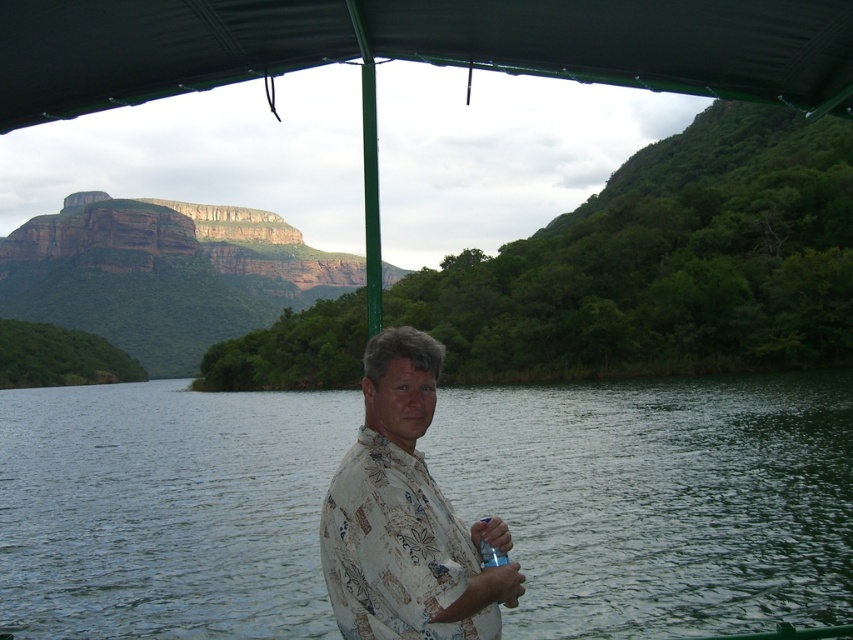
You are a photographer positioned at the camera. You see two points in the scene labeled as point (662,566) and point (424,362). Which point is closer to your camera?

Point (662,566) is further to the camera than point (424,362), so the closer point to the camera is point (424,362).

You are a photographer positioned at the camera location. You want to capture a photo of the green liquid water at center from your current position. Considering the distance, will you need a telephoto lens to ensure the water appears large enough in the frame?

The green liquid water at center is 82.39 feet away from the camera. To ensure the water appears large enough in the frame from this distance, you would need a telephoto lens.